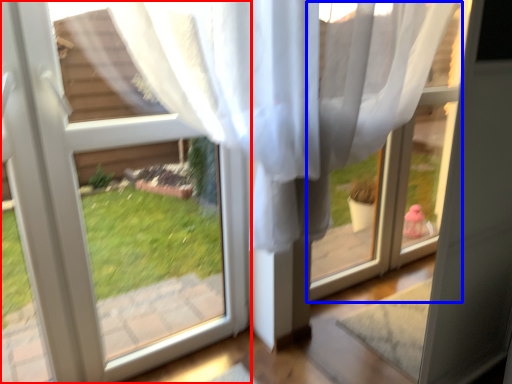
Question: Which of the following is the farthest to the observer, window (highlighted by a red box) or window frame (highlighted by a blue box)?

Choices:
 (A) window
 (B) window frame

Answer: (A)